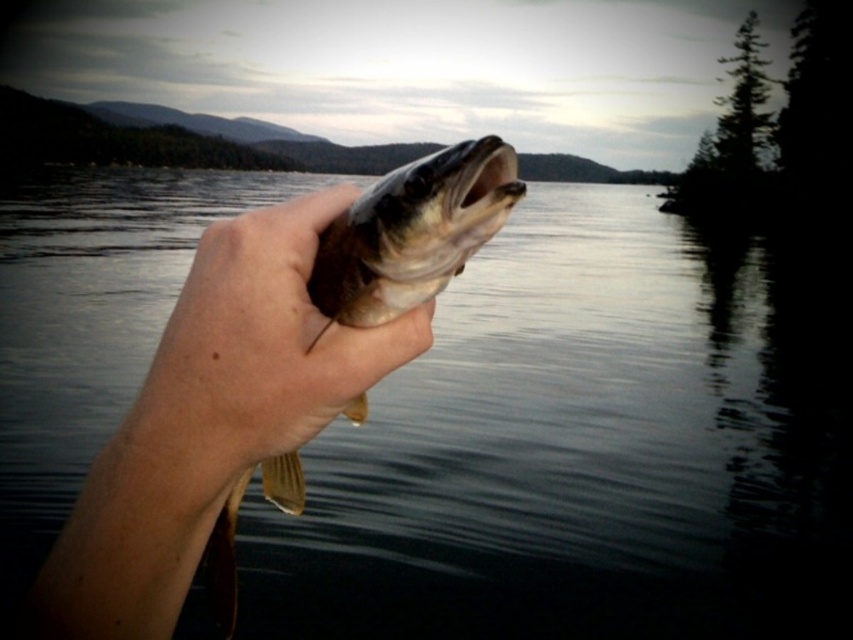
Question: Which object appears closest to the camera in this image?

Choices:
 (A) glossy water at center
 (B) smooth skin hand at center

Answer: (B)

Question: Can you confirm if glossy water at center is positioned to the right of smooth skin hand at center?

Choices:
 (A) no
 (B) yes

Answer: (A)

Question: Is glossy water at center smaller than smooth skin hand at center?

Choices:
 (A) yes
 (B) no

Answer: (B)

Question: Is glossy water at center to the left of smooth skin hand at center from the viewer's perspective?

Choices:
 (A) no
 (B) yes

Answer: (B)

Question: Which point is closer to the camera?

Choices:
 (A) glossy water at center
 (B) smooth skin hand at center

Answer: (B)

Question: Which object is closer to the camera taking this photo?

Choices:
 (A) smooth skin hand at center
 (B) glossy water at center

Answer: (A)